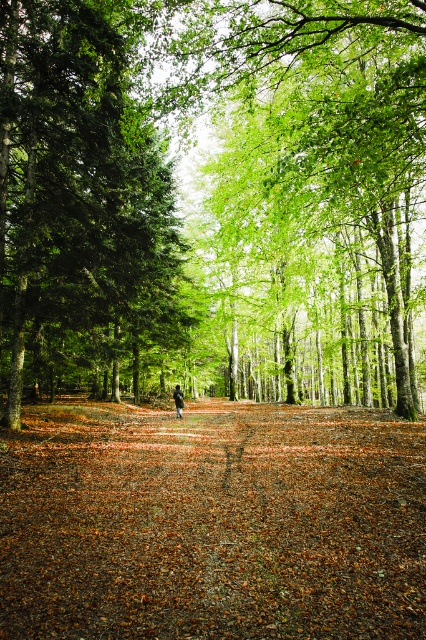
Question: Does green matte tree at center have a smaller size compared to dark brown leather jacket at center?

Choices:
 (A) yes
 (B) no

Answer: (B)

Question: Is green leafy trees at center smaller than dark brown leather jacket at center?

Choices:
 (A) yes
 (B) no

Answer: (B)

Question: Is green matte tree at center positioned behind dark brown leather jacket at center?

Choices:
 (A) yes
 (B) no

Answer: (B)

Question: Which point appears farthest from the camera in this image?

Choices:
 (A) (282, 602)
 (B) (180, 417)

Answer: (B)

Question: Among these points, which one is nearest to the camera?

Choices:
 (A) (112, 410)
 (B) (175, 218)
 (C) (178, 396)

Answer: (C)

Question: Which of the following is the closest to the observer?

Choices:
 (A) green leafy trees at center
 (B) green matte tree at center
 (C) brown dirt path at center
 (D) dark brown leather jacket at center

Answer: (C)